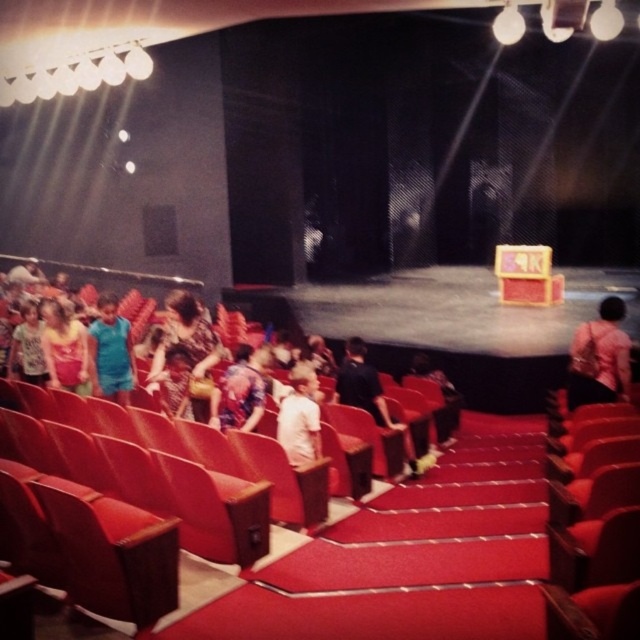
Between floral fabric dress at center and white matte shirt at center, which one has less height?

white matte shirt at center is shorter.

Which is more to the left, floral fabric dress at center or white matte shirt at center?

Positioned to the left is floral fabric dress at center.

Between point (253, 390) and point (278, 410), which one is positioned behind?

The point (278, 410) is behind.

Where is `floral fabric dress at center`? Image resolution: width=640 pixels, height=640 pixels. floral fabric dress at center is located at coordinates (241, 392).

Who is taller, blue fabric shirt at center or white matte shirt at center?

Standing taller between the two is blue fabric shirt at center.

Who is more distant from viewer, (108,326) or (307,404)?

The point (108,326) is more distant.

The height and width of the screenshot is (640, 640). I want to click on blue fabric shirt at center, so click(109, 352).

Based on the photo, does pink fabric purse at center have a larger size compared to white matte shirt at center?

Indeed, pink fabric purse at center has a larger size compared to white matte shirt at center.

Can you confirm if pink fabric purse at center is positioned above white matte shirt at center?

Yes.

Describe the element at coordinates (600, 356) in the screenshot. The image size is (640, 640). I see `pink fabric purse at center` at that location.

Locate an element on the screen. Image resolution: width=640 pixels, height=640 pixels. pink fabric purse at center is located at coordinates (600, 356).